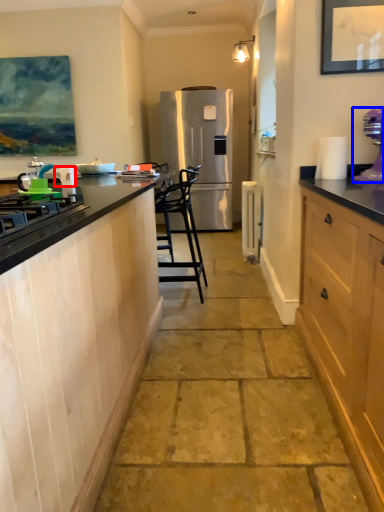
Question: Which object is further to the camera taking this photo, appliance (highlighted by a red box) or kitchen appliance (highlighted by a blue box)?

Choices:
 (A) appliance
 (B) kitchen appliance

Answer: (A)